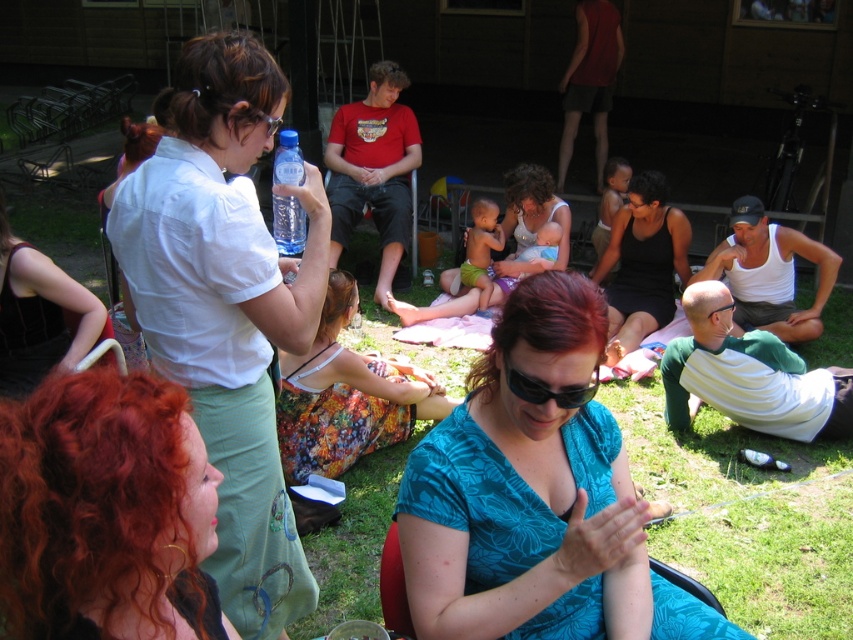
You are standing at the point labeled point (672, 292) and want to walk to the point labeled point (727, 308). Which direction should you move to get closer to your destination?

You should move away from the viewer because point (672, 292) is closer to the viewer than point (727, 308). Moving away from the viewer will bring you closer to the destination.